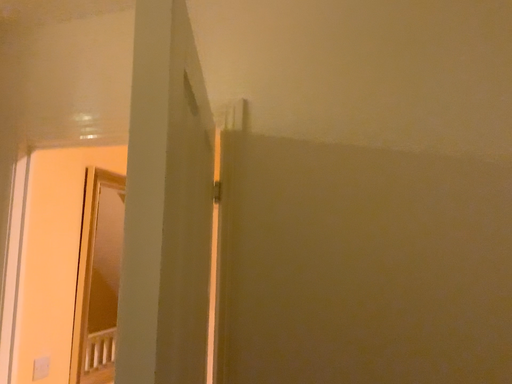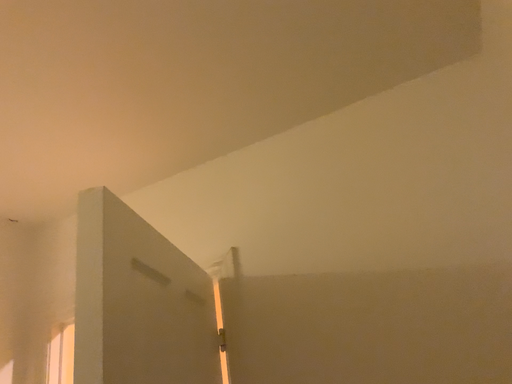
Question: How did the camera likely rotate when shooting the video?

Choices:
 (A) rotated downward
 (B) rotated upward

Answer: (B)